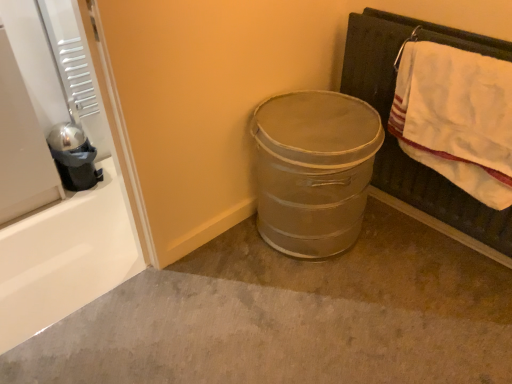
Find the location of a particular element. vacant space in front of metallic gray trash can at center is located at coordinates (321, 310).